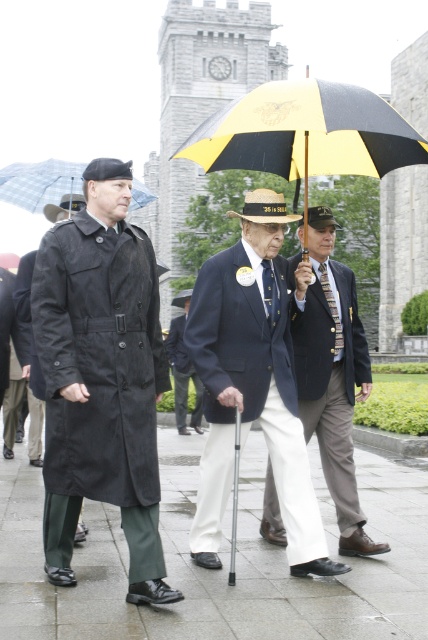
Question: Is black/yellow striped umbrella at center thinner than yellow fabric umbrella at upper left?

Choices:
 (A) no
 (B) yes

Answer: (A)

Question: Which point appears closest to the camera in this image?

Choices:
 (A) (174, 320)
 (B) (357, 595)
 (C) (0, 179)

Answer: (B)

Question: Can you confirm if smooth concrete pavement at center is positioned to the right of black/yellow striped umbrella at center?

Choices:
 (A) no
 (B) yes

Answer: (A)

Question: Estimate the real-world distances between objects in this image. Which object is farther from the smooth concrete pavement at center?

Choices:
 (A) dark blue fabric coat at center
 (B) white cotton suit at center

Answer: (A)

Question: Which object is closer to the camera taking this photo?

Choices:
 (A) yellow fabric umbrella at upper left
 (B) matte black suit at center

Answer: (B)

Question: Can you confirm if white cotton suit at center is positioned to the right of blue fabric umbrella at upper left?

Choices:
 (A) no
 (B) yes

Answer: (B)